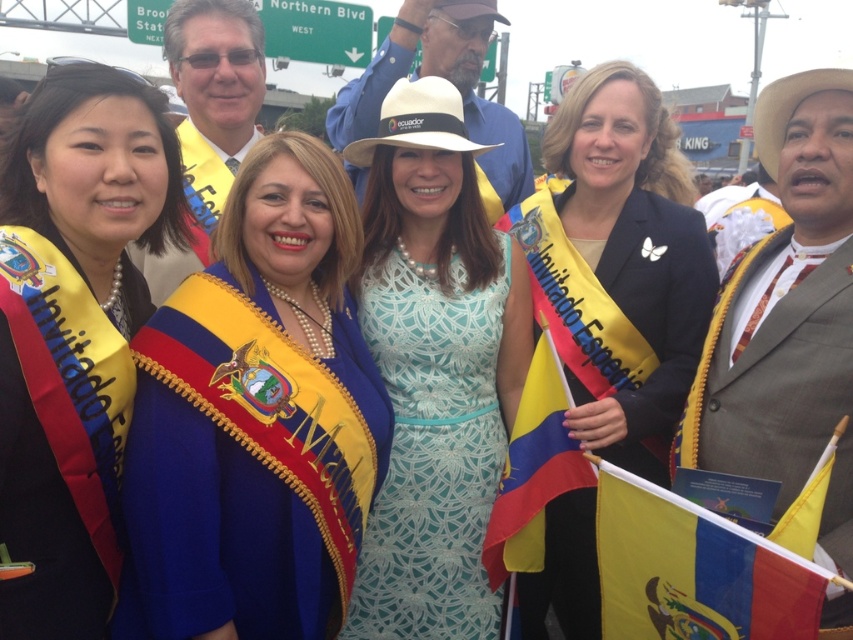
Question: Is blue satin sash at center positioned at the back of yellowtextured fabricflag at center-right?

Choices:
 (A) no
 (B) yes

Answer: (A)

Question: Is yellow fabric flag at lower right to the right of yellowtextured fabricflag at center-right from the viewer's perspective?

Choices:
 (A) yes
 (B) no

Answer: (A)

Question: Which of the following is the farthest from the observer?

Choices:
 (A) (532, 384)
 (B) (340, 422)

Answer: (A)

Question: Among these points, which one is farthest from the camera?

Choices:
 (A) (506, 483)
 (B) (427, 545)
 (C) (810, 577)

Answer: (B)

Question: Among these objects, which one is nearest to the camera?

Choices:
 (A) blue satin sash at left
 (B) yellowtextured fabricflag at center-right
 (C) blue satin sash at center

Answer: (A)

Question: Can you confirm if yellow fabric flag at lower right is wider than yellowtextured fabricflag at center-right?

Choices:
 (A) yes
 (B) no

Answer: (A)